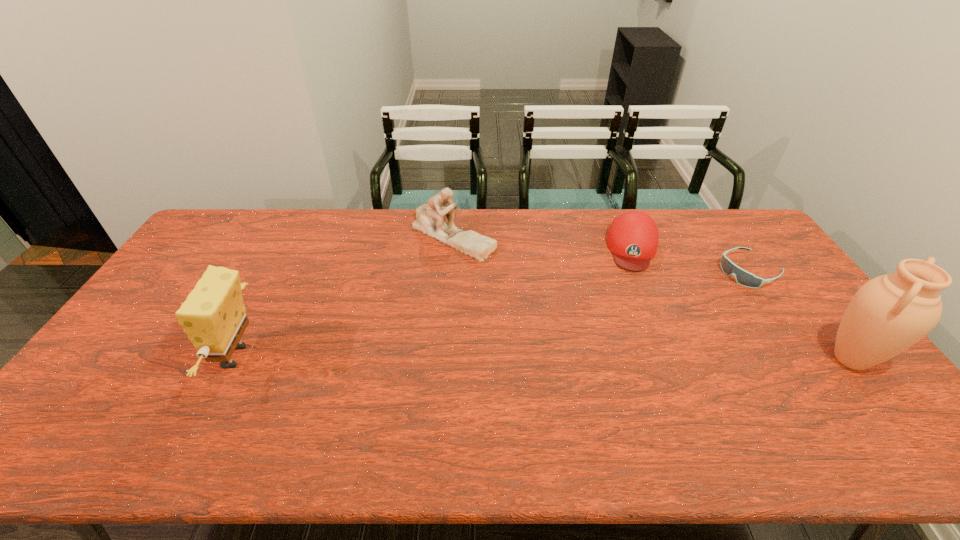
Locate an element on the screen. vacant area situated 0.160m on the front-facing side of the goggles is located at coordinates (696, 299).

The image size is (960, 540). I want to click on figurine that is at the far edge, so click(x=430, y=220).

Where is `baseball cap positioned at the far edge`? This screenshot has width=960, height=540. baseball cap positioned at the far edge is located at coordinates (632, 238).

Locate an element on the screen. sponge located in the near edge section of the desktop is located at coordinates (213, 316).

Locate an element on the screen. urn positioned at the near edge is located at coordinates (888, 314).

The width and height of the screenshot is (960, 540). I want to click on urn positioned at the right edge, so click(x=888, y=314).

The width and height of the screenshot is (960, 540). I want to click on goggles located at the right edge, so click(744, 278).

Image resolution: width=960 pixels, height=540 pixels. What are the coordinates of `object that is at the near right corner` in the screenshot? It's located at (888, 314).

In the image, there is a desktop. At what (x,y) coordinates should I click in order to perform the action: click on free space at the far edge. Please return your answer as a coordinate pair (x, y). Image resolution: width=960 pixels, height=540 pixels. Looking at the image, I should click on (577, 246).

Locate an element on the screen. The width and height of the screenshot is (960, 540). vacant space at the near edge of the desktop is located at coordinates (670, 403).